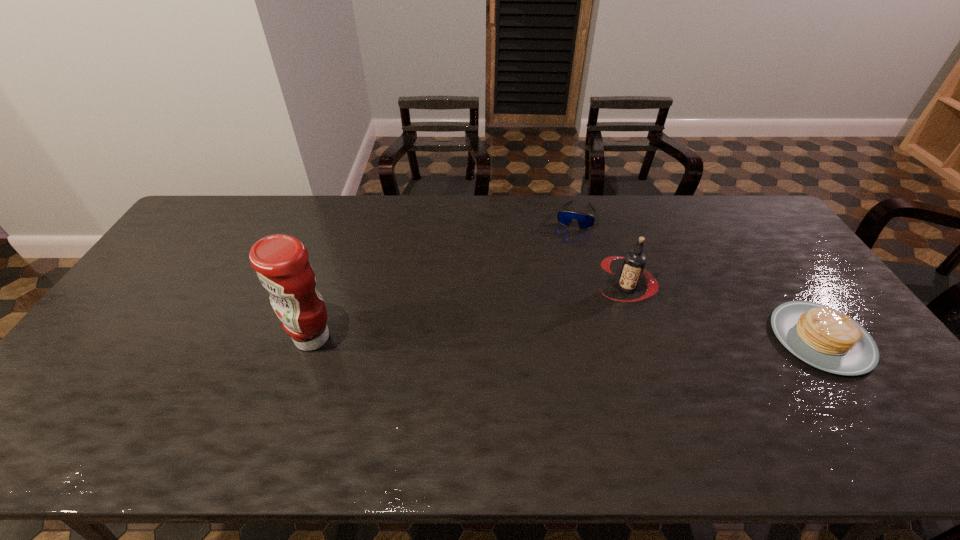
In order to click on vacant area at the right edge in this screenshot , I will do `click(790, 270)`.

The width and height of the screenshot is (960, 540). What are the coordinates of `vacant position at the far left corner of the desktop` in the screenshot? It's located at (228, 205).

Locate an element on the screen. This screenshot has height=540, width=960. empty space between the sunglasses and the leftmost object is located at coordinates (444, 276).

Identify the location of unoccupied area between the farthest object and the tallest object. (444, 276).

Locate an element on the screen. free space that is in between the root beer and the tallest object is located at coordinates (469, 313).

Locate an element on the screen. unoccupied area between the sunglasses and the root beer is located at coordinates (600, 251).

Image resolution: width=960 pixels, height=540 pixels. Identify the location of empty location between the leftmost object and the pancake. pyautogui.click(x=566, y=338).

Find the location of a particular element. free point between the second tallest object and the condiment is located at coordinates (469, 313).

Where is `free space between the third shortest object and the farthest object`? The image size is (960, 540). free space between the third shortest object and the farthest object is located at coordinates (600, 251).

Where is `vacant area between the farthest object and the leftmost object`? The width and height of the screenshot is (960, 540). vacant area between the farthest object and the leftmost object is located at coordinates (444, 276).